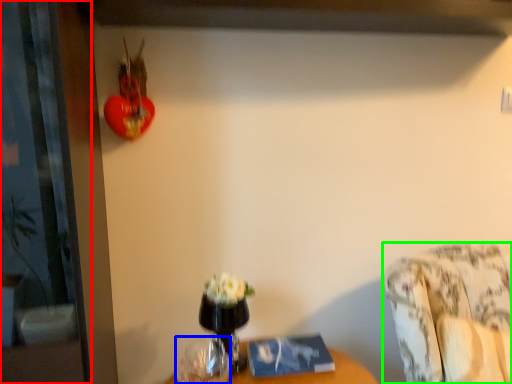
Question: Which object is the closest to the screen door (highlighted by a red box)? Choose among these: vase (highlighted by a blue box) or furniture (highlighted by a green box).

Choices:
 (A) vase
 (B) furniture

Answer: (A)